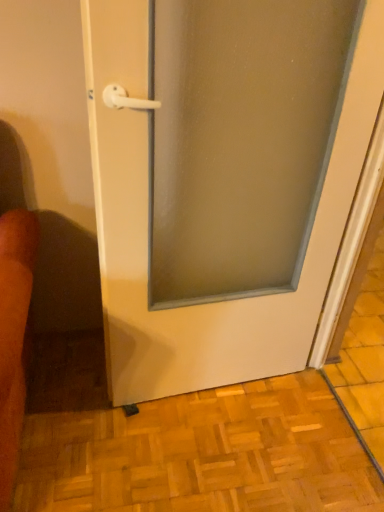
Question: Does white glossy door at center touch wooden parquet floor at lower center?

Choices:
 (A) yes
 (B) no

Answer: (B)

Question: From a real-world perspective, is white glossy door at center on wooden parquet floor at lower center?

Choices:
 (A) no
 (B) yes

Answer: (B)

Question: From the image's perspective, would you say white glossy door at center is positioned over wooden parquet floor at lower center?

Choices:
 (A) yes
 (B) no

Answer: (A)

Question: Is white glossy door at center turned away from wooden parquet floor at lower center?

Choices:
 (A) yes
 (B) no

Answer: (B)

Question: Can you confirm if white glossy door at center is smaller than wooden parquet floor at lower center?

Choices:
 (A) no
 (B) yes

Answer: (A)

Question: From the image's perspective, is white glossy door at center beneath wooden parquet floor at lower center?

Choices:
 (A) yes
 (B) no

Answer: (B)

Question: From a real-world perspective, is wooden parquet floor at lower center located beneath white glossy door at center?

Choices:
 (A) yes
 (B) no

Answer: (A)

Question: Is wooden parquet floor at lower center not inside white glossy door at center?

Choices:
 (A) yes
 (B) no

Answer: (A)

Question: Is wooden parquet floor at lower center positioned in front of white glossy door at center?

Choices:
 (A) no
 (B) yes

Answer: (A)

Question: Is wooden parquet floor at lower center at the left side of white glossy door at center?

Choices:
 (A) yes
 (B) no

Answer: (A)

Question: Considering the relative sizes of wooden parquet floor at lower center and white glossy door at center in the image provided, is wooden parquet floor at lower center bigger than white glossy door at center?

Choices:
 (A) yes
 (B) no

Answer: (B)

Question: Can you confirm if wooden parquet floor at lower center is thinner than white glossy door at center?

Choices:
 (A) yes
 (B) no

Answer: (B)

Question: Is wooden parquet floor at lower center inside or outside of white glossy door at center?

Choices:
 (A) outside
 (B) inside

Answer: (A)